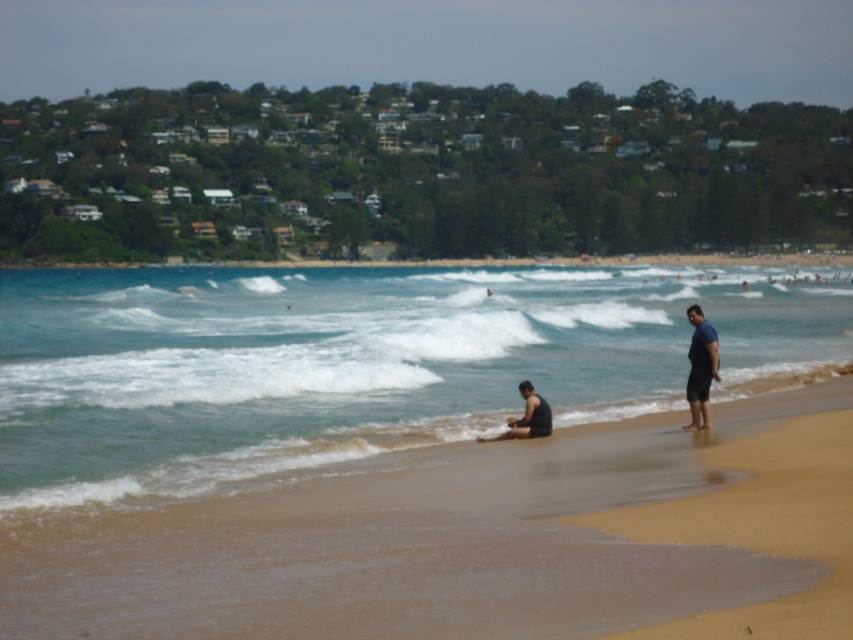
Which of these two, clear blue water at center or blue fabric shorts at right, stands taller?

clear blue water at center

Which of these two, clear blue water at center or blue fabric shorts at right, stands shorter?

Standing shorter between the two is blue fabric shorts at right.

At what (x,y) coordinates should I click in order to perform the action: click on clear blue water at center. Please return your answer as a coordinate pair (x, y). The image size is (853, 640). Looking at the image, I should click on (355, 362).

Who is lower down, brown sandy beach at lower center or black matte shirt at lower center?

brown sandy beach at lower center

Where is `brown sandy beach at lower center`? The image size is (853, 640). brown sandy beach at lower center is located at coordinates (410, 545).

Image resolution: width=853 pixels, height=640 pixels. I want to click on brown sandy beach at lower center, so click(x=410, y=545).

Is clear blue water at center to the left of black matte shirt at lower center from the viewer's perspective?

Indeed, clear blue water at center is positioned on the left side of black matte shirt at lower center.

Between point (672, 374) and point (534, 396), which one is positioned in front?

Positioned in front is point (534, 396).

The height and width of the screenshot is (640, 853). I want to click on clear blue water at center, so click(x=355, y=362).